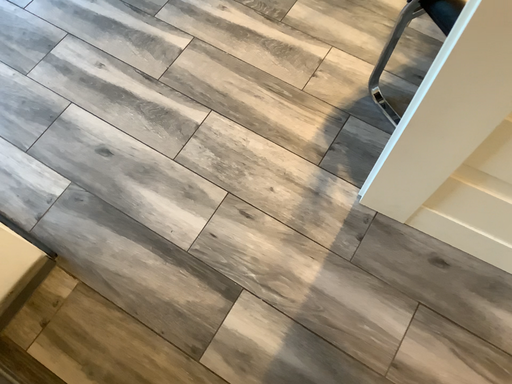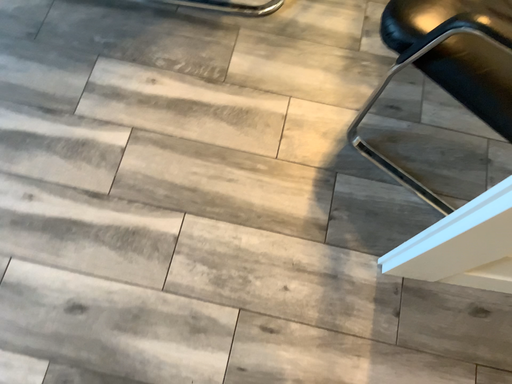
Question: How did the camera likely rotate when shooting the video?

Choices:
 (A) rotated left
 (B) rotated right

Answer: (B)